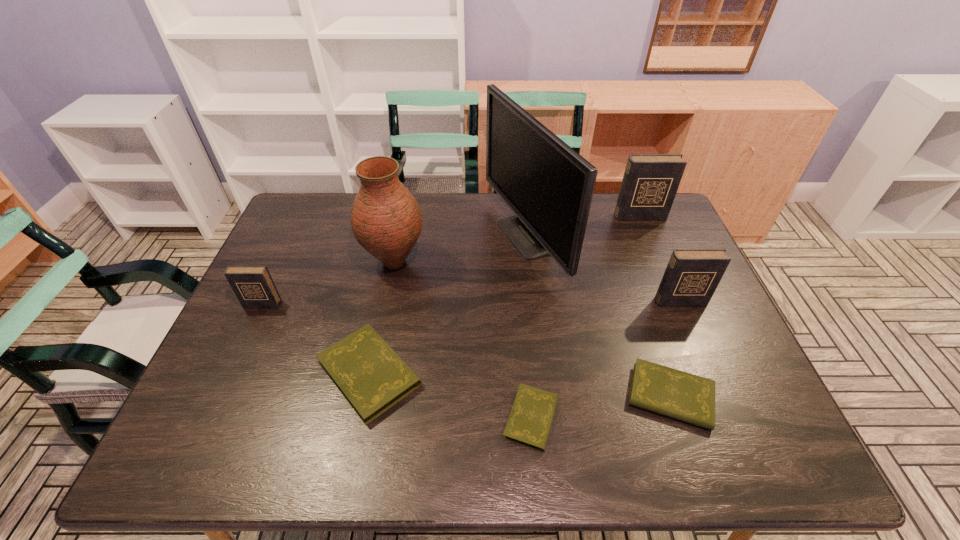
The image size is (960, 540). I want to click on the tallest object, so click(x=549, y=186).

Find the location of a particular element. The width and height of the screenshot is (960, 540). vase is located at coordinates (386, 220).

This screenshot has width=960, height=540. Identify the location of the tallest diary. (650, 182).

Where is `the farthest dark diary`? This screenshot has height=540, width=960. the farthest dark diary is located at coordinates (650, 182).

This screenshot has width=960, height=540. What are the coordinates of `the second smallest dark diary` in the screenshot? It's located at (691, 277).

Identify the location of the fifth shortest object. (691, 277).

Locate an element on the screen. the leftmost dark diary is located at coordinates (253, 285).

At what (x,y) coordinates should I click in order to perform the action: click on the leftmost object. Please return your answer as a coordinate pair (x, y). Looking at the image, I should click on (x=253, y=285).

Where is `the biggest green diary`? The width and height of the screenshot is (960, 540). the biggest green diary is located at coordinates (371, 376).

You are a GUI agent. You are given a task and a screenshot of the screen. Output one action in this format:
    pyautogui.click(x=<x>, y=<y>)
    Task: Click on the leftmost green diary
    This screenshot has width=960, height=540.
    Given the screenshot: What is the action you would take?
    pyautogui.click(x=371, y=376)